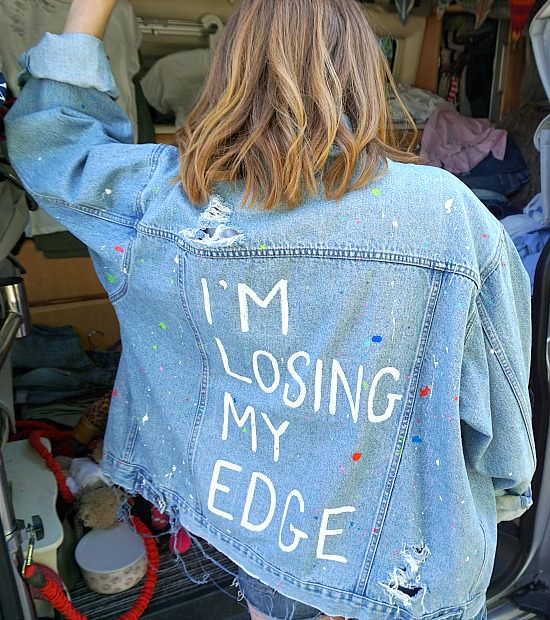
Locate an element on the screen. floor is located at coordinates (206, 608).